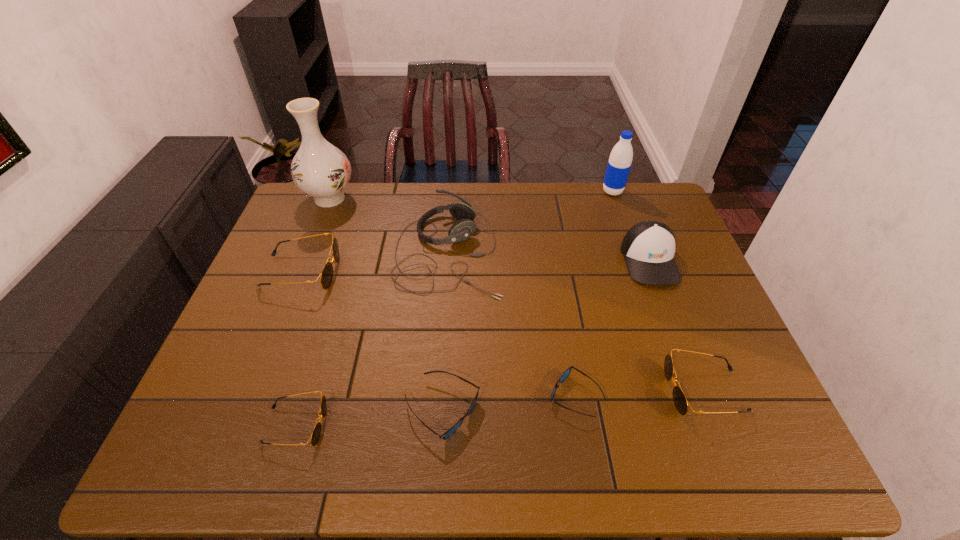
This screenshot has height=540, width=960. I want to click on vase, so coord(321,170).

I want to click on blue water bottle, so click(620, 160).

Locate an element on the screen. The image size is (960, 540). water bottle is located at coordinates tap(620, 160).

The image size is (960, 540). I want to click on gray cap, so click(x=648, y=247).

This screenshot has height=540, width=960. Find the location of `headset`. headset is located at coordinates (462, 230).

The width and height of the screenshot is (960, 540). In order to click on the fifth tallest object in this screenshot , I will do `click(326, 276)`.

Identify the location of the tallest sunglasses. The image size is (960, 540). (326, 276).

The image size is (960, 540). Identify the location of the fourth shortest object. point(680,401).

You are a GUI agent. You are given a task and a screenshot of the screen. Output one action in this format:
    pyautogui.click(x=<x>, y=<y>)
    Task: Click on the rightmost black sunglasses
    
    Given the screenshot: What is the action you would take?
    pyautogui.click(x=680, y=401)

Find the location of a particular element. the bigger blue sunglasses is located at coordinates (453, 429).